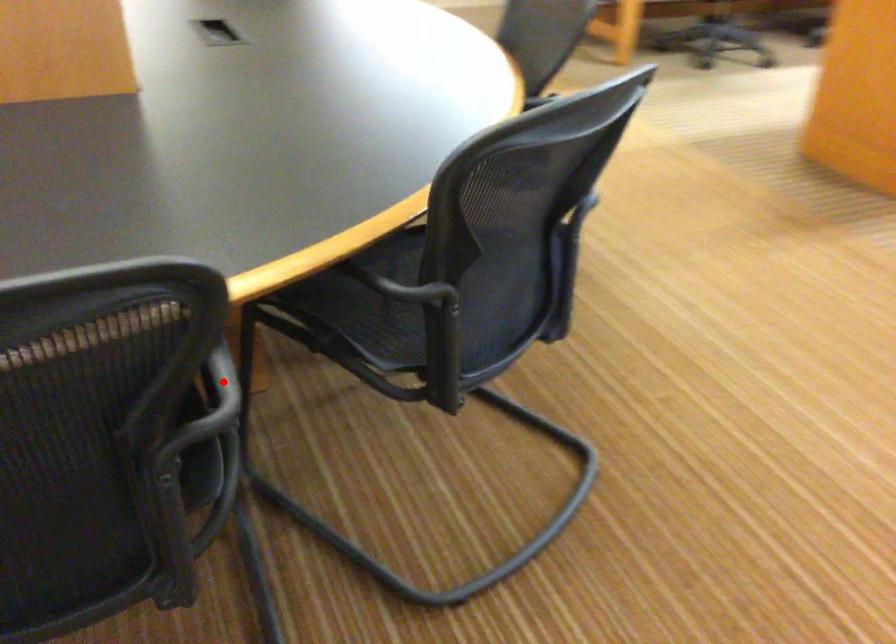
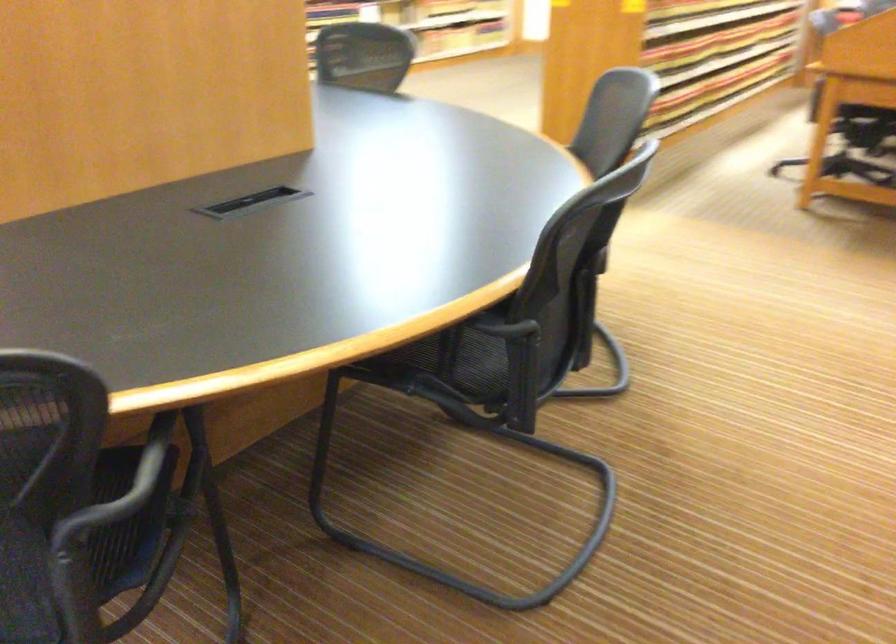
Question: I am providing you with two images of the same scene from different viewpoints. A red point is marked on the first image. Is the red point's position out of view in image 2?

Choices:
 (A) Yes
 (B) No

Answer: (A)